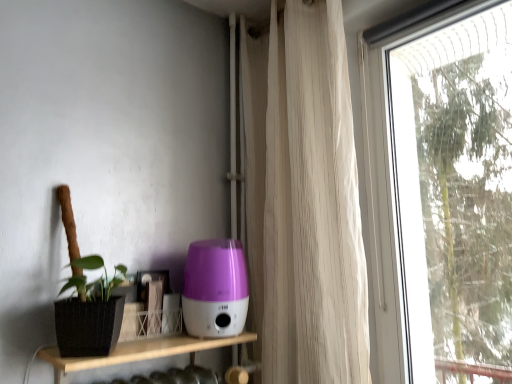
This screenshot has width=512, height=384. In order to click on blank space situated above wooden shelf at lower left (from a real-world perspective) in this screenshot , I will do `click(152, 338)`.